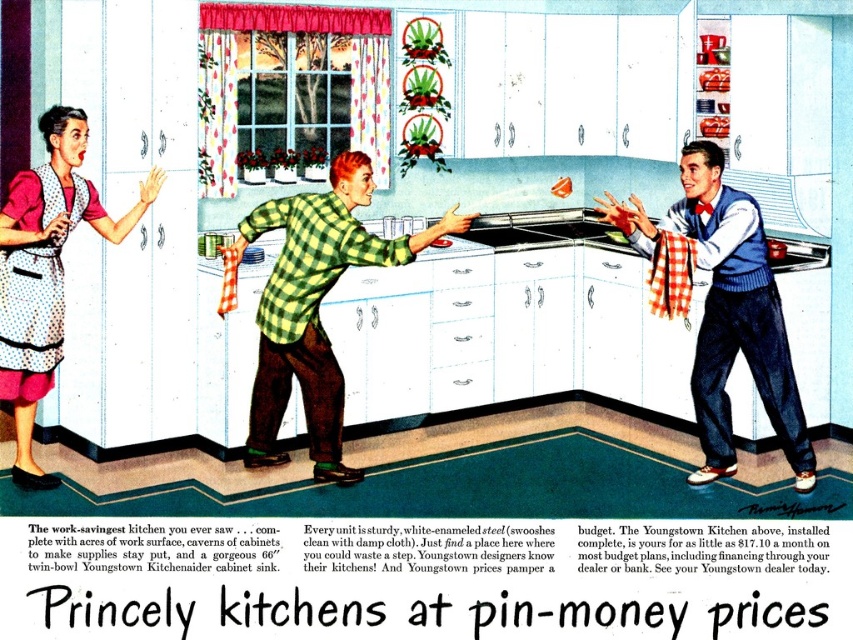
Based on the photo, you are a tailor who needs to determine which clothing item requires more fabric to alter. You see a green plaid shirt at center and a blue sweater at center in the image. Which one would need more fabric due to its size?

The green plaid shirt at center has a larger size compared to the blue sweater at center, so it would require more fabric for alterations.

In the vintage Youngstown Kitchens advertisement, there is a woman wearing a green plaid shirt at center. Where exactly is she positioned in the image?

The green plaid shirt at center is positioned at point (x=315, y=307) in the image.

You are a fashion designer observing the vintage kitchen advertisement. You notice two garments in the scene. The first is the blue sweater at center, and the second is the white dotted fabric apron at left. Which garment has a larger size?

The blue sweater at center is bigger than the white dotted fabric apron at left, so the blue sweater at center has a larger size.